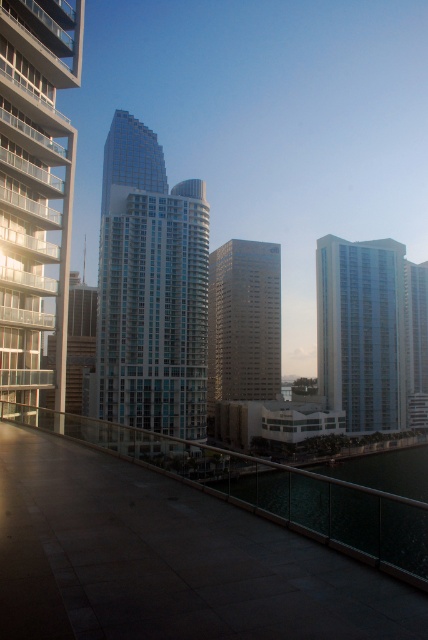
Question: Does glassy steel building at left appear under gold reflective building at center?

Choices:
 (A) no
 (B) yes

Answer: (A)

Question: Which point appears farthest from the camera in this image?

Choices:
 (A) (323, 305)
 (B) (73, 42)

Answer: (A)

Question: Is glassy steel building at left positioned before gold reflective building at center?

Choices:
 (A) no
 (B) yes

Answer: (B)

Question: Which of these objects is positioned farthest from the glassy steel building at left?

Choices:
 (A) gold reflective building at center
 (B) metallic glass railing at center
 (C) matte glass building at right

Answer: (C)

Question: Does glassy steel building at left have a larger size compared to gold reflective building at center?

Choices:
 (A) no
 (B) yes

Answer: (A)

Question: Which point appears farthest from the camera in this image?

Choices:
 (A) (15, 45)
 (B) (116, 209)

Answer: (B)